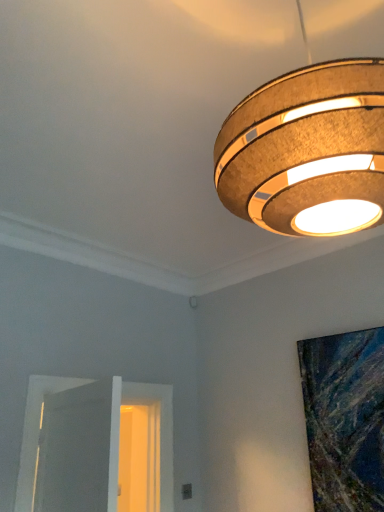
Question: Considering the relative positions of textured cork lampshade at upper right and white wooden door at lower left in the image provided, is textured cork lampshade at upper right to the right of white wooden door at lower left from the viewer's perspective?

Choices:
 (A) no
 (B) yes

Answer: (B)

Question: Can you confirm if textured cork lampshade at upper right is wider than white wooden door at lower left?

Choices:
 (A) yes
 (B) no

Answer: (A)

Question: Is textured cork lampshade at upper right shorter than white wooden door at lower left?

Choices:
 (A) no
 (B) yes

Answer: (A)

Question: Is textured cork lampshade at upper right touching white wooden door at lower left?

Choices:
 (A) no
 (B) yes

Answer: (A)

Question: Can you confirm if textured cork lampshade at upper right is taller than white wooden door at lower left?

Choices:
 (A) yes
 (B) no

Answer: (A)

Question: From a real-world perspective, is textured cork lampshade at upper right over white wooden door at lower left?

Choices:
 (A) no
 (B) yes

Answer: (B)

Question: Does white wooden door at lower left come behind textured cork lampshade at upper right?

Choices:
 (A) no
 (B) yes

Answer: (B)

Question: Does white wooden door at lower left have a greater height compared to textured cork lampshade at upper right?

Choices:
 (A) yes
 (B) no

Answer: (B)

Question: Is white wooden door at lower left shorter than textured cork lampshade at upper right?

Choices:
 (A) no
 (B) yes

Answer: (B)

Question: Considering the relative sizes of white wooden door at lower left and textured cork lampshade at upper right in the image provided, is white wooden door at lower left thinner than textured cork lampshade at upper right?

Choices:
 (A) no
 (B) yes

Answer: (B)

Question: Can we say white wooden door at lower left lies outside textured cork lampshade at upper right?

Choices:
 (A) no
 (B) yes

Answer: (B)

Question: From a real-world perspective, is white wooden door at lower left physically below textured cork lampshade at upper right?

Choices:
 (A) no
 (B) yes

Answer: (B)

Question: From the image's perspective, is white wooden door at lower left located above or below textured cork lampshade at upper right?

Choices:
 (A) above
 (B) below

Answer: (B)